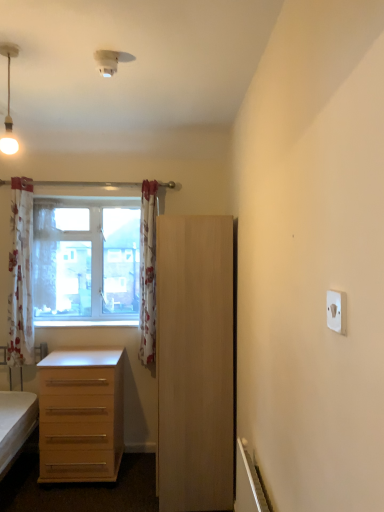
Question: Can you confirm if white floral curtain at window, the second curtain when ordered from right to left, is thinner than floral fabric curtain at center, which ranks as the 3th curtain in left-to-right order?

Choices:
 (A) yes
 (B) no

Answer: (A)

Question: Does white floral curtain at window, which is the second curtain from left to right, have a lesser height compared to floral fabric curtain at center, which appears as the first curtain when viewed from the right?

Choices:
 (A) no
 (B) yes

Answer: (B)

Question: From a real-world perspective, is white floral curtain at window, which is the second curtain from left to right, positioned under floral fabric curtain at center, which appears as the first curtain when viewed from the right, based on gravity?

Choices:
 (A) yes
 (B) no

Answer: (B)

Question: Is white floral curtain at window, which is the second curtain from left to right, positioned before floral fabric curtain at center, which appears as the first curtain when viewed from the right?

Choices:
 (A) no
 (B) yes

Answer: (A)

Question: Considering the relative positions of white floral curtain at window, the second curtain when ordered from right to left, and floral fabric curtain at center, which ranks as the 3th curtain in left-to-right order, in the image provided, is white floral curtain at window, the second curtain when ordered from right to left, to the left of floral fabric curtain at center, which ranks as the 3th curtain in left-to-right order, from the viewer's perspective?

Choices:
 (A) no
 (B) yes

Answer: (B)

Question: Considering their positions, is white plastic electric outlet at upper right located in front of or behind light wood cabinet at center?

Choices:
 (A) behind
 (B) front

Answer: (B)

Question: Is white plastic electric outlet at upper right inside or outside of light wood cabinet at center?

Choices:
 (A) outside
 (B) inside

Answer: (A)

Question: In terms of height, does white plastic electric outlet at upper right look taller or shorter compared to light wood cabinet at center?

Choices:
 (A) tall
 (B) short

Answer: (B)

Question: From the image's perspective, is white plastic electric outlet at upper right positioned above or below light wood cabinet at center?

Choices:
 (A) above
 (B) below

Answer: (A)

Question: Is clear glass window at upper left spatially inside light wood cabinet at center, or outside of it?

Choices:
 (A) inside
 (B) outside

Answer: (B)

Question: From a real-world perspective, is clear glass window at upper left positioned above or below light wood cabinet at center?

Choices:
 (A) above
 (B) below

Answer: (A)

Question: From the image's perspective, is clear glass window at upper left located above or below light wood cabinet at center?

Choices:
 (A) below
 (B) above

Answer: (B)

Question: Is point (104, 264) closer or farther from the camera than point (162, 505)?

Choices:
 (A) closer
 (B) farther

Answer: (B)

Question: Is white floral curtain at window, which is the second curtain from left to right, situated inside matte white pendant light at upper left or outside?

Choices:
 (A) inside
 (B) outside

Answer: (B)

Question: Would you say white floral curtain at window, which is the second curtain from left to right, is to the left or to the right of matte white pendant light at upper left in the picture?

Choices:
 (A) left
 (B) right

Answer: (A)